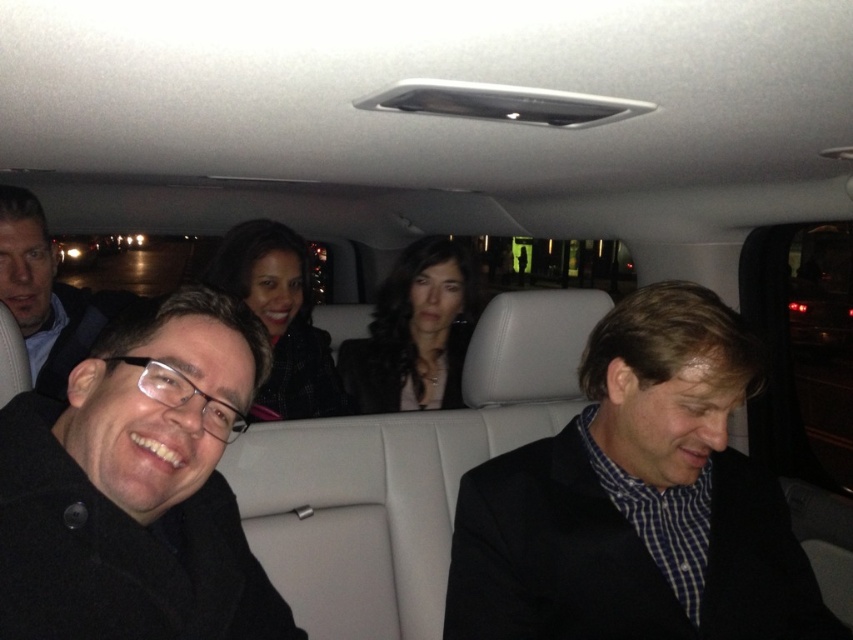
Between black matte coat at lower left and matte black jacket at center, which one is positioned higher?

matte black jacket at center is higher up.

Does point (173, 444) come closer to viewer compared to point (277, 364)?

That is True.

The image size is (853, 640). What do you see at coordinates (137, 486) in the screenshot? I see `black matte coat at lower left` at bounding box center [137, 486].

Locate an element on the screen. The width and height of the screenshot is (853, 640). black matte coat at lower left is located at coordinates (137, 486).

Between dark blue checkered shirt at center and matte black glasses at left, which one appears on the left side from the viewer's perspective?

matte black glasses at left is more to the left.

In order to click on dark blue checkered shirt at center in this screenshot , I will do `click(637, 500)`.

I want to click on dark blue checkered shirt at center, so click(x=637, y=500).

Looking at this image, can you confirm if black matte coat at lower left is positioned to the right of matte black glasses at left?

Indeed, black matte coat at lower left is positioned on the right side of matte black glasses at left.

Describe the element at coordinates (137, 486) in the screenshot. I see `black matte coat at lower left` at that location.

Locate an element on the screen. black matte coat at lower left is located at coordinates (137, 486).